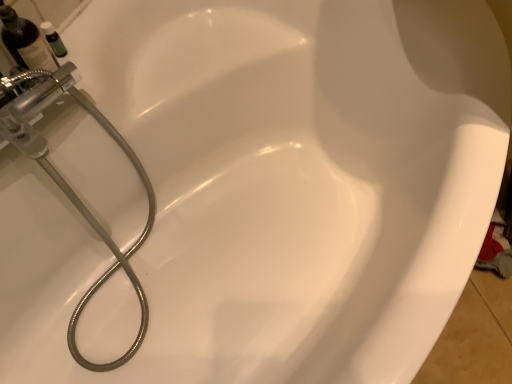
Question: Is brushed metal showerhead at left turned away from matte black bottle at upper left?

Choices:
 (A) yes
 (B) no

Answer: (A)

Question: Can you confirm if brushed metal showerhead at left is smaller than matte black bottle at upper left?

Choices:
 (A) no
 (B) yes

Answer: (A)

Question: Can you confirm if brushed metal showerhead at left is bigger than matte black bottle at upper left?

Choices:
 (A) no
 (B) yes

Answer: (B)

Question: Can you confirm if brushed metal showerhead at left is thinner than matte black bottle at upper left?

Choices:
 (A) yes
 (B) no

Answer: (B)

Question: From the image's perspective, is brushed metal showerhead at left located above matte black bottle at upper left?

Choices:
 (A) yes
 (B) no

Answer: (B)

Question: From a real-world perspective, is matte black bottle at upper left above or below brushed metal showerhead at left?

Choices:
 (A) above
 (B) below

Answer: (A)

Question: From the image's perspective, is matte black bottle at upper left located above or below brushed metal showerhead at left?

Choices:
 (A) above
 (B) below

Answer: (A)

Question: Is matte black bottle at upper left bigger or smaller than brushed metal showerhead at left?

Choices:
 (A) big
 (B) small

Answer: (B)

Question: Is point (5, 11) positioned closer to the camera than point (150, 228)?

Choices:
 (A) closer
 (B) farther

Answer: (A)

Question: Considering the positions of brushed metal showerhead at left and green glass bottle at upper left in the image, is brushed metal showerhead at left wider or thinner than green glass bottle at upper left?

Choices:
 (A) wide
 (B) thin

Answer: (A)

Question: Considering their positions, is brushed metal showerhead at left located in front of or behind green glass bottle at upper left?

Choices:
 (A) front
 (B) behind

Answer: (A)

Question: Is point (126, 256) closer or farther from the camera than point (50, 36)?

Choices:
 (A) farther
 (B) closer

Answer: (A)

Question: Is brushed metal showerhead at left taller or shorter than green glass bottle at upper left?

Choices:
 (A) short
 (B) tall

Answer: (B)

Question: Is brushed metal showerhead at left wider or thinner than matte black bottle at upper left?

Choices:
 (A) wide
 (B) thin

Answer: (A)

Question: Looking at the image, does brushed metal showerhead at left seem bigger or smaller compared to matte black bottle at upper left?

Choices:
 (A) big
 (B) small

Answer: (A)